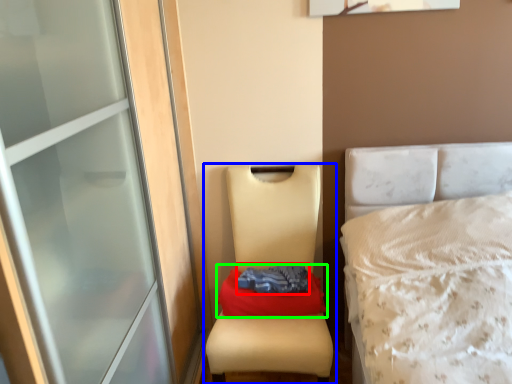
Question: Which is nearer to the clothing (highlighted by a red box)? furniture (highlighted by a blue box) or material (highlighted by a green box).

Choices:
 (A) furniture
 (B) material

Answer: (B)